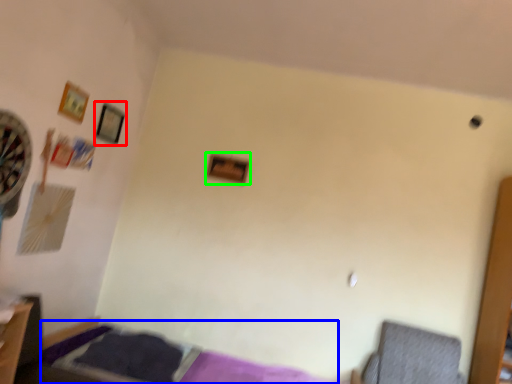
Question: Estimate the real-world distances between objects in this image. Which object is closer to picture frame (highlighted by a red box), bed (highlighted by a blue box) or picture frame (highlighted by a green box)?

Choices:
 (A) bed
 (B) picture frame

Answer: (B)